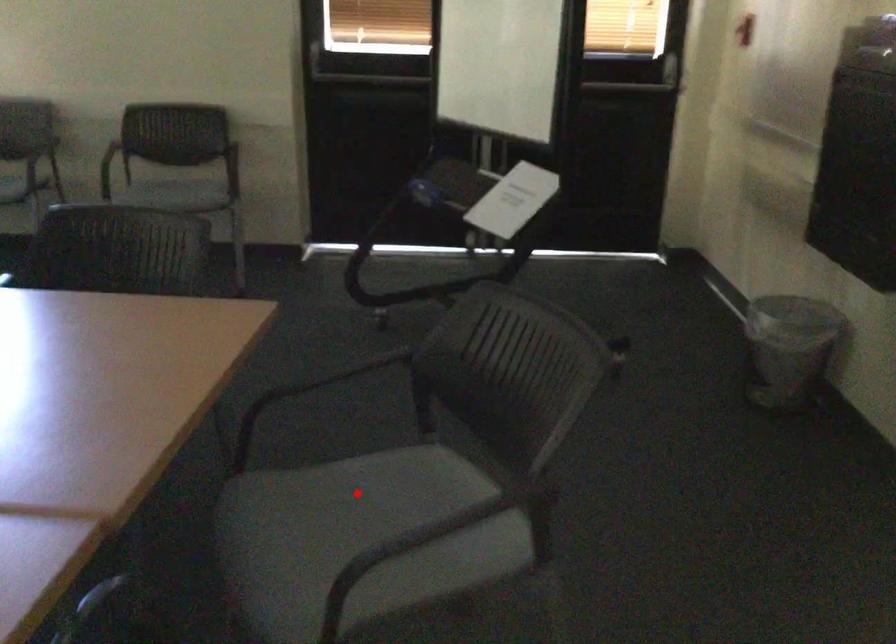
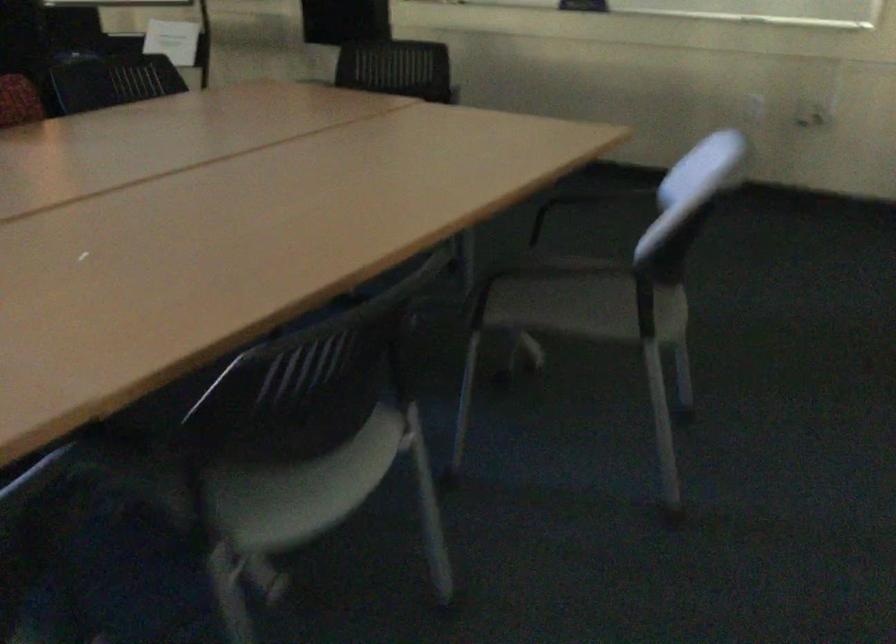
Question: I am providing you with two images of the same scene from different viewpoints. A red point is marked on the first image. At the location where the point appears in image 1, is it still visible in image 2?

Choices:
 (A) Yes
 (B) No

Answer: (B)